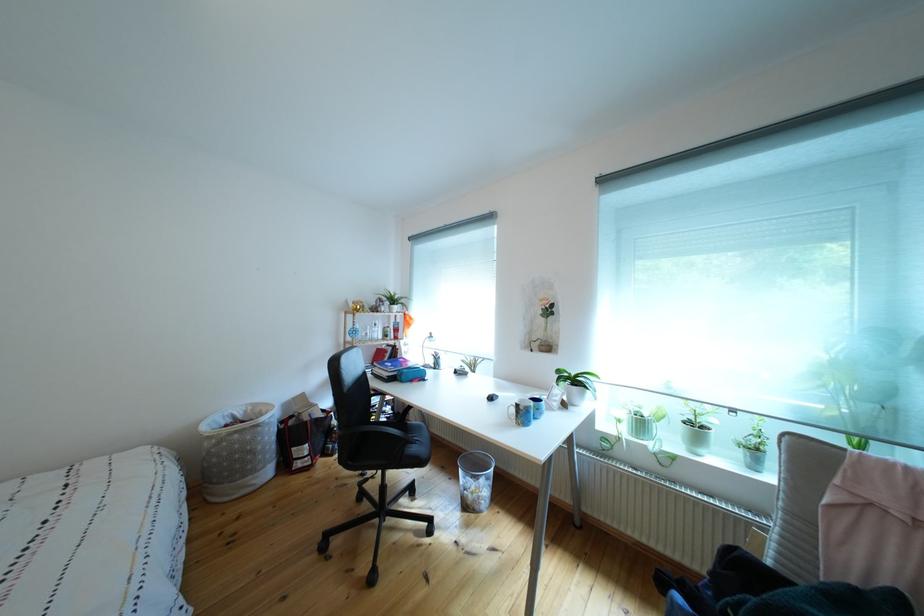
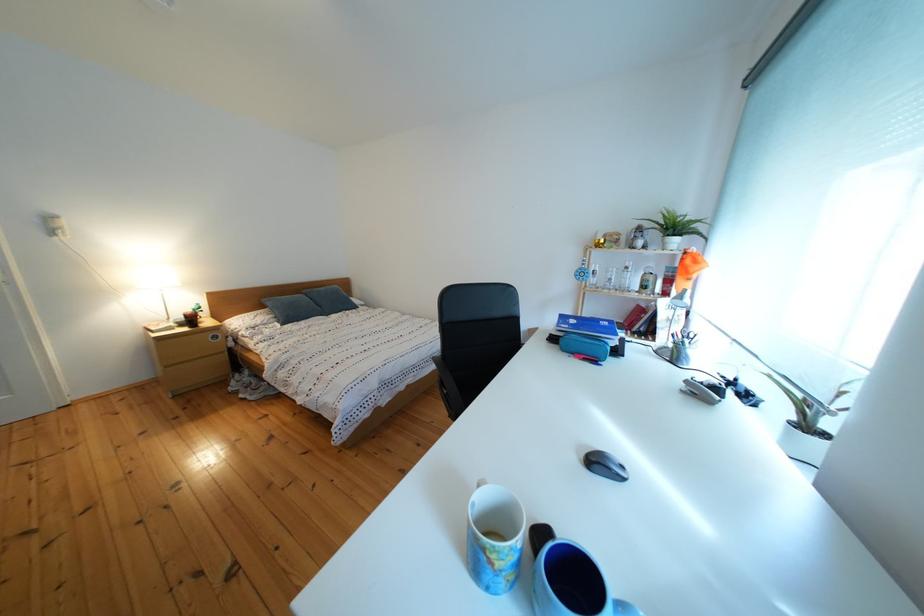
Where in the second image is the point corresponding to pixel 419 323 from the first image?

(699, 267)